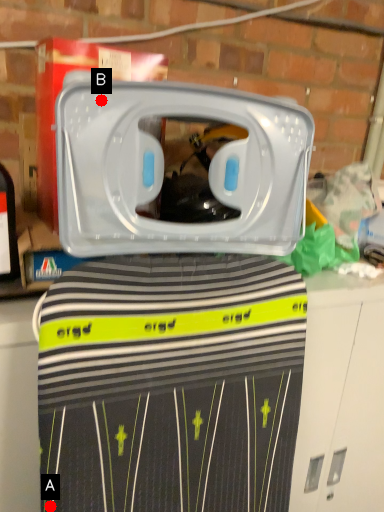
Question: Two points are circled on the image, labeled by A and B beside each circle. Among these points, which one is nearest to the camera?

Choices:
 (A) A is closer
 (B) B is closer

Answer: (B)